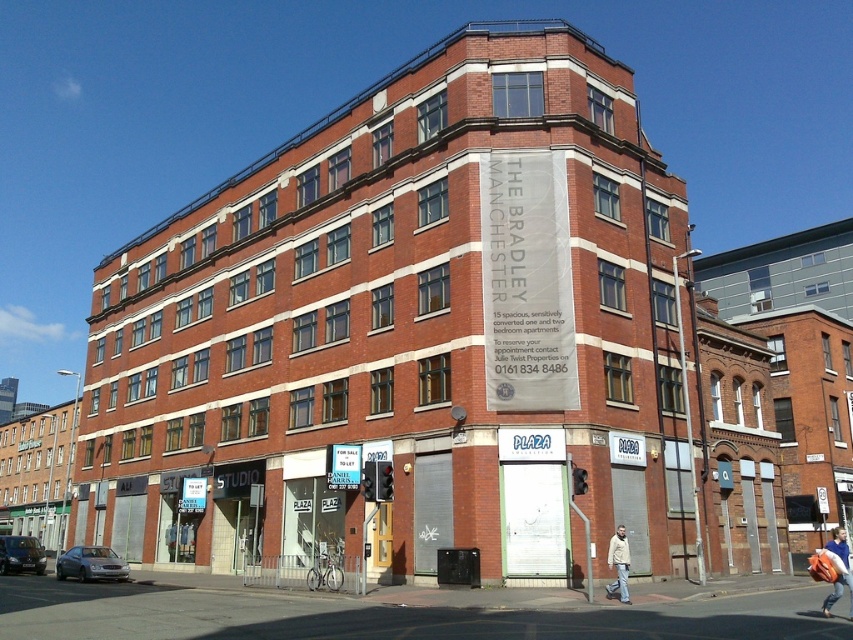
Question: Does blue denim jacket at lower right appear on the right side of beige fabric jacket at lower right?

Choices:
 (A) yes
 (B) no

Answer: (A)

Question: Does blue denim jacket at lower right appear over beige fabric jacket at lower right?

Choices:
 (A) yes
 (B) no

Answer: (B)

Question: Which object is farther from the camera taking this photo?

Choices:
 (A) blue denim jacket at lower right
 (B) beige fabric jacket at lower right

Answer: (B)

Question: Is blue denim jacket at lower right above beige fabric jacket at lower right?

Choices:
 (A) yes
 (B) no

Answer: (B)

Question: Which of the following is the closest to the observer?

Choices:
 (A) (840, 548)
 (B) (619, 563)

Answer: (A)